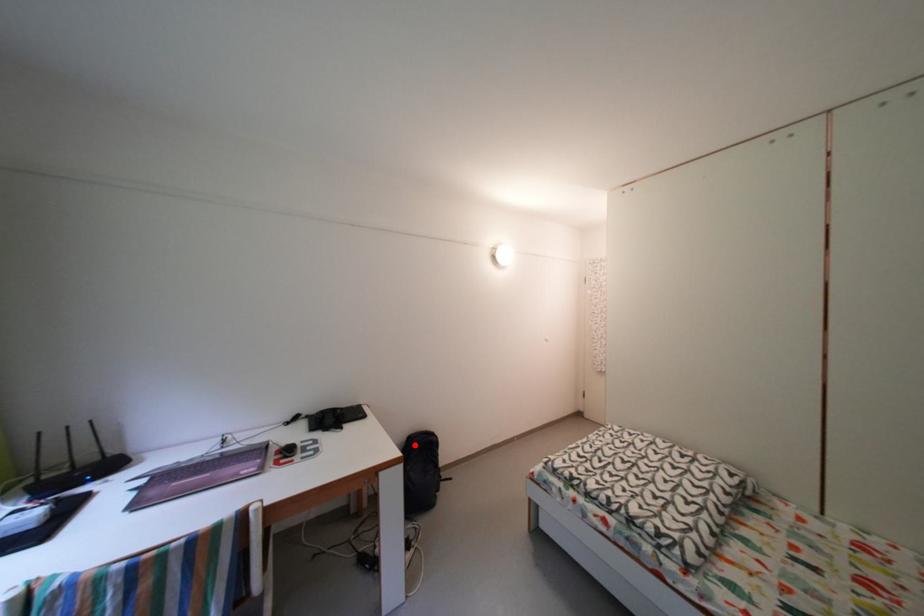
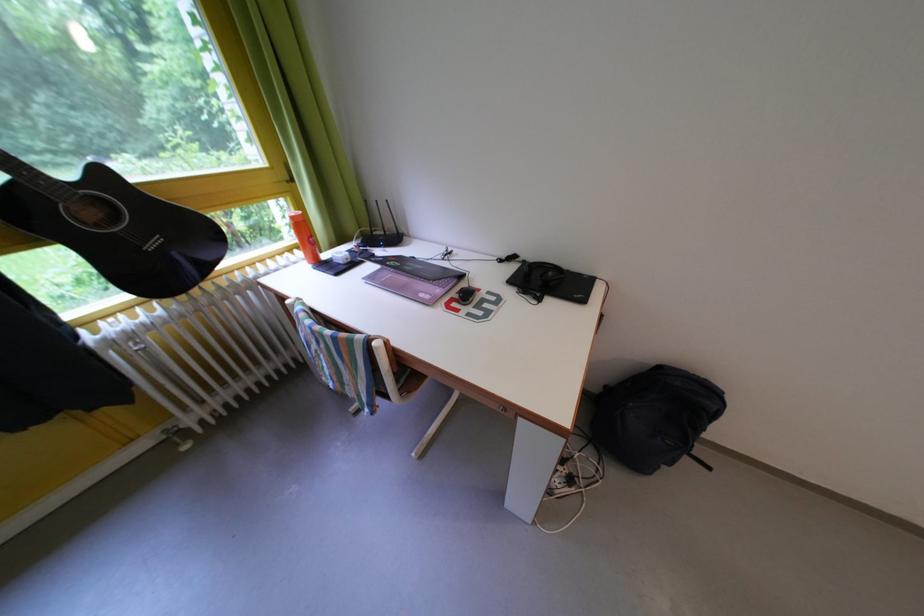
Find the pixel in the second image that matches the highlighted location in the first image.

(663, 370)